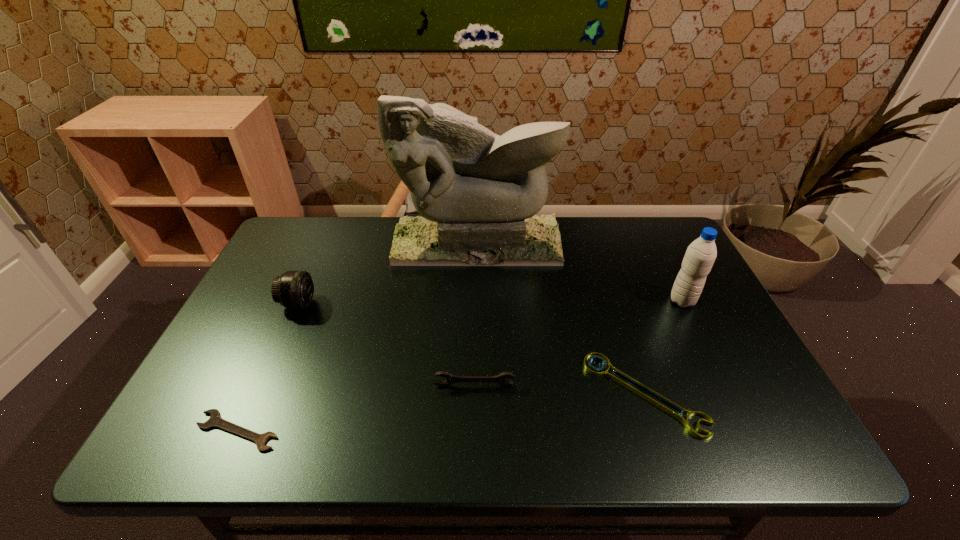
Locate an element on the screen. Image resolution: width=960 pixels, height=540 pixels. the shortest object is located at coordinates (215, 420).

At what (x,y) coordinates should I click in order to perform the action: click on blank area located 0.060m on the base of the sculpture. Please return your answer as a coordinate pair (x, y). This screenshot has height=540, width=960. Looking at the image, I should click on (477, 279).

The image size is (960, 540). Find the location of `vacant space situated on the back of the rightmost object`. vacant space situated on the back of the rightmost object is located at coordinates (664, 265).

The height and width of the screenshot is (540, 960). In order to click on free space located on the front-facing side of the telephoto lens in this screenshot , I will do `click(341, 303)`.

This screenshot has width=960, height=540. In order to click on free space located 0.110m on the open ends of the second wrench from left to right in this screenshot , I will do `click(473, 431)`.

Where is `free space located 0.130m on the left of the second shortest wrench`? The height and width of the screenshot is (540, 960). free space located 0.130m on the left of the second shortest wrench is located at coordinates (531, 394).

Image resolution: width=960 pixels, height=540 pixels. In order to click on free space located 0.250m on the back of the shortest object in this screenshot , I will do `click(285, 324)`.

This screenshot has height=540, width=960. Identify the location of object present at the far edge. (478, 193).

The image size is (960, 540). In order to click on telephoto lens present at the left edge in this screenshot , I will do `click(293, 289)`.

The height and width of the screenshot is (540, 960). Find the location of `wrench that is at the left edge`. wrench that is at the left edge is located at coordinates (215, 420).